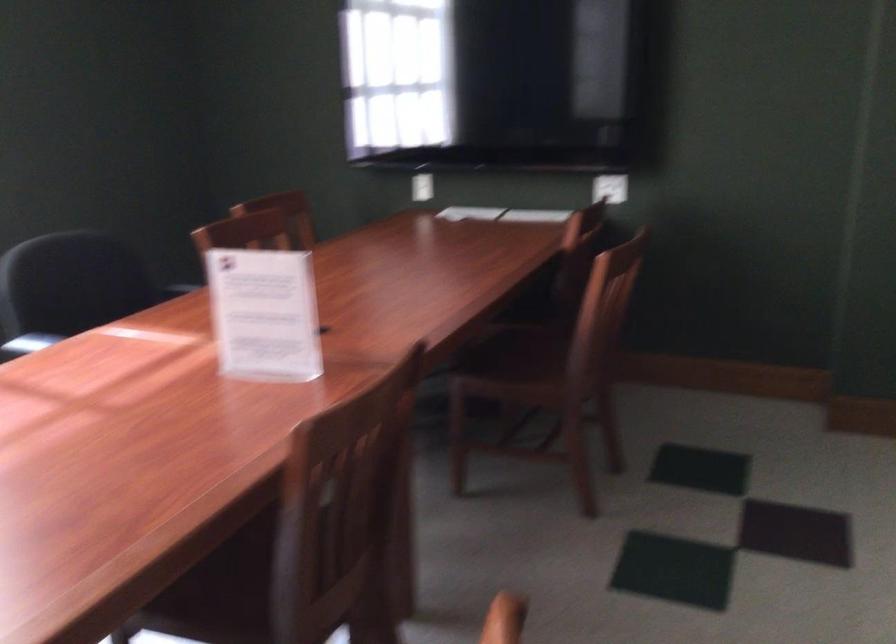
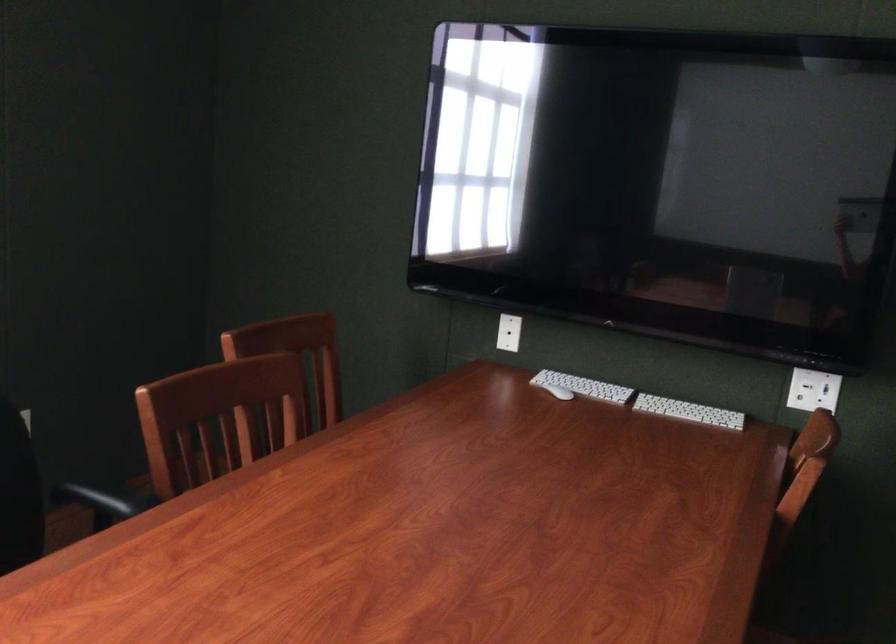
In the second image, find the point that corresponds to (607,185) in the first image.

(813, 390)